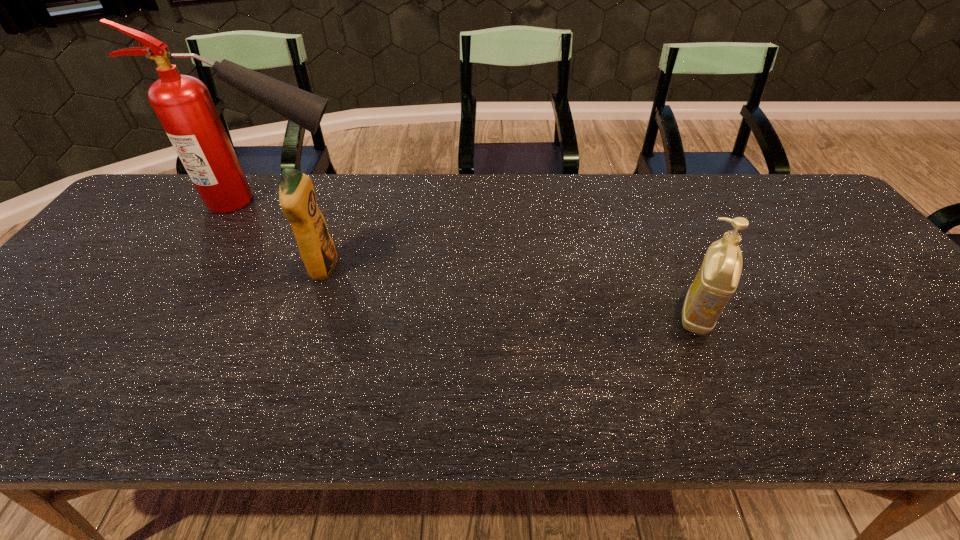
Select which object appears as the closest to the farthest object. Please provide its 2D coordinates. Your answer should be formatted as a tuple, i.e. [(x, y)], where the tuple contains the x and y coordinates of a point satisfying the conditions above.

[(297, 198)]

Identify which object is the second closest to the rightmost object. Please provide its 2D coordinates. Your answer should be formatted as a tuple, i.e. [(x, y)], where the tuple contains the x and y coordinates of a point satisfying the conditions above.

[(182, 103)]

Locate an element on the screen. This screenshot has height=540, width=960. vacant region that satisfies the following two spatial constraints: 1. on the back side of the nearest object; 2. at the nozzle of the fire extinguisher is located at coordinates (647, 201).

In order to click on free space that satisfies the following two spatial constraints: 1. on the label of the nearest object; 2. on the right side of the second tallest object in this screenshot , I will do `click(307, 315)`.

The height and width of the screenshot is (540, 960). In order to click on free space that satisfies the following two spatial constraints: 1. on the label of the taller detergent; 2. on the right side of the shorter detergent in this screenshot , I will do click(307, 315).

I want to click on vacant area that satisfies the following two spatial constraints: 1. at the nozzle of the tallest object; 2. on the left side of the nearest object, so click(x=209, y=315).

The image size is (960, 540). Find the location of `free space that satisfies the following two spatial constraints: 1. on the label of the shorter detergent; 2. on the right side of the farther detergent`. free space that satisfies the following two spatial constraints: 1. on the label of the shorter detergent; 2. on the right side of the farther detergent is located at coordinates (307, 315).

The width and height of the screenshot is (960, 540). I want to click on free spot that satisfies the following two spatial constraints: 1. at the nozzle of the farthest object; 2. on the back side of the rightmost object, so click(x=209, y=315).

At what (x,y) coordinates should I click in order to perform the action: click on vacant region that satisfies the following two spatial constraints: 1. at the nozzle of the tallest object; 2. on the back side of the right detergent. Please return your answer as a coordinate pair (x, y). Looking at the image, I should click on (209, 315).

The image size is (960, 540). In order to click on free location that satisfies the following two spatial constraints: 1. at the nozzle of the shorter detergent; 2. on the right side of the farthest object in this screenshot , I will do `click(209, 315)`.